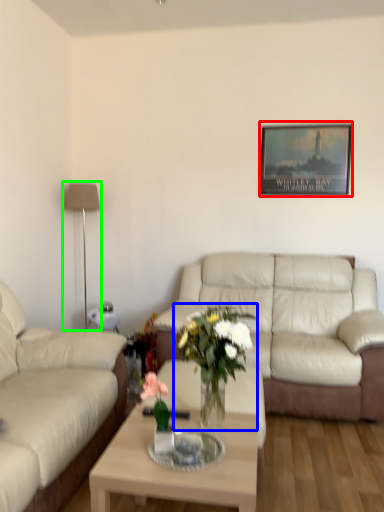
Question: Which is farther away from picture frame (highlighted by a red box)? houseplant (highlighted by a blue box) or lamp (highlighted by a green box)?

Choices:
 (A) houseplant
 (B) lamp

Answer: (A)